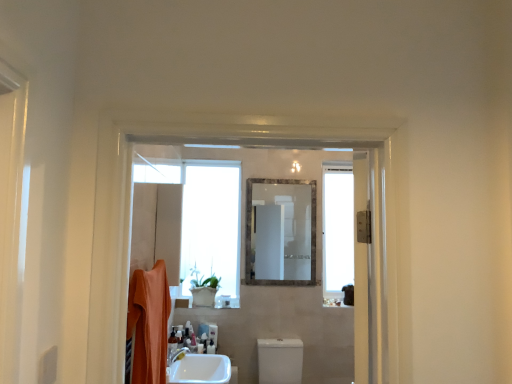
Question: From the image's perspective, is transparent glass window at right located above white glossy tap at lower center?

Choices:
 (A) no
 (B) yes

Answer: (B)

Question: Can you confirm if transparent glass window at right is thinner than white glossy tap at lower center?

Choices:
 (A) yes
 (B) no

Answer: (A)

Question: Could white glossy tap at lower center be considered to be inside transparent glass window at right?

Choices:
 (A) yes
 (B) no

Answer: (B)

Question: Is transparent glass window at right outside of white glossy tap at lower center?

Choices:
 (A) no
 (B) yes

Answer: (B)

Question: From a real-world perspective, is transparent glass window at right under white glossy tap at lower center?

Choices:
 (A) yes
 (B) no

Answer: (B)

Question: Does transparent glass window at right lie behind white glossy tap at lower center?

Choices:
 (A) yes
 (B) no

Answer: (A)

Question: Is white glossy tap at lower center thinner than translucent plastic bottle at lower center, which is counted as the 2th toiletry, starting from the right?

Choices:
 (A) no
 (B) yes

Answer: (A)

Question: Is white glossy tap at lower center surrounding translucent plastic bottle at lower center, which is counted as the 2th toiletry, starting from the right?

Choices:
 (A) yes
 (B) no

Answer: (B)

Question: From a real-world perspective, is white glossy tap at lower center on top of translucent plastic bottle at lower center, which is counted as the 2th toiletry, starting from the right?

Choices:
 (A) yes
 (B) no

Answer: (B)

Question: Is white glossy tap at lower center not close to translucent plastic bottle at lower center, which is counted as the 2th toiletry, starting from the back?

Choices:
 (A) yes
 (B) no

Answer: (B)

Question: From a real-world perspective, is white glossy tap at lower center beneath translucent plastic bottle at lower center, which is counted as the 2th toiletry, starting from the right?

Choices:
 (A) yes
 (B) no

Answer: (A)

Question: Is white glossy tap at lower center wider than translucent plastic bottle at lower center, the second toiletry from the bottom?

Choices:
 (A) no
 (B) yes

Answer: (B)

Question: Is white glossy toilet at center turned away from white glossy tap at lower center?

Choices:
 (A) no
 (B) yes

Answer: (A)